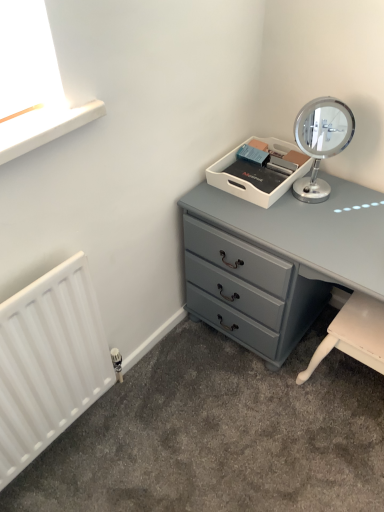
The width and height of the screenshot is (384, 512). What do you see at coordinates (283, 260) in the screenshot?
I see `matte gray chest of drawers at center` at bounding box center [283, 260].

This screenshot has height=512, width=384. I want to click on matte gray chest of drawers at center, so click(x=283, y=260).

From the image's perspective, is polished chrome mirror at upper right located beneath matte gray chest of drawers at center?

No, from the image's perspective, polished chrome mirror at upper right is not below matte gray chest of drawers at center.

Is polished chrome mirror at upper right not close to matte gray chest of drawers at center?

They are positioned close to each other.

Does polished chrome mirror at upper right lie behind matte gray chest of drawers at center?

Yes, polished chrome mirror at upper right is further from the camera.

From the image's perspective, is white matte radiator at lower left over white plastic tray at upper center?

No.

Is white plastic tray at upper center a part of white matte radiator at lower left?

That's incorrect, white plastic tray at upper center is not inside white matte radiator at lower left.

Considering the positions of objects white matte radiator at lower left and white plastic tray at upper center in the image provided, who is more to the left, white matte radiator at lower left or white plastic tray at upper center?

From the viewer's perspective, white matte radiator at lower left appears more on the left side.

Considering the relative sizes of white matte radiator at lower left and white plastic tray at upper center in the image provided, is white matte radiator at lower left thinner than white plastic tray at upper center?

Yes, white matte radiator at lower left is thinner than white plastic tray at upper center.

Can you confirm if white matte radiator at lower left is positioned to the left of matte gray chest of drawers at center?

Yes, white matte radiator at lower left is to the left of matte gray chest of drawers at center.

Would you say white matte radiator at lower left is a long distance from matte gray chest of drawers at center?

No.

Between white matte radiator at lower left and matte gray chest of drawers at center, which one is positioned behind?

matte gray chest of drawers at center.

Is white matte radiator at lower left taller than matte gray chest of drawers at center?

Correct, white matte radiator at lower left is much taller as matte gray chest of drawers at center.

Which of these two, polished chrome mirror at upper right or white matte radiator at lower left, stands shorter?

With less height is polished chrome mirror at upper right.

Is polished chrome mirror at upper right not within white matte radiator at lower left?

Yes, polished chrome mirror at upper right is not within white matte radiator at lower left.

Does point (308, 113) come behind point (5, 365)?

Yes, it is behind point (5, 365).

Is polished chrome mirror at upper right facing towards white matte radiator at lower left?

No, polished chrome mirror at upper right is not aimed at white matte radiator at lower left.

From a real-world perspective, is white plastic tray at upper center positioned over polished chrome mirror at upper right based on gravity?

No, from a real-world perspective, white plastic tray at upper center is not above polished chrome mirror at upper right.

Are white plastic tray at upper center and polished chrome mirror at upper right far apart?

No, white plastic tray at upper center is not far away from polished chrome mirror at upper right.

In the scene shown: Is white plastic tray at upper center behind polished chrome mirror at upper right?

Yes, it is.

Which is behind, point (313, 112) or point (271, 144)?

The point (271, 144) is farther from the camera.

Does polished chrome mirror at upper right appear on the left side of white plastic tray at upper center?

No, polished chrome mirror at upper right is not to the left of white plastic tray at upper center.

Is polished chrome mirror at upper right smaller than white plastic tray at upper center?

No.

Who is shorter, polished chrome mirror at upper right or white plastic tray at upper center?

With less height is white plastic tray at upper center.

From a real-world perspective, is matte gray chest of drawers at center beneath white plastic tray at upper center?

Yes, from a real-world perspective, matte gray chest of drawers at center is under white plastic tray at upper center.

Considering the relative positions of matte gray chest of drawers at center and white plastic tray at upper center in the image provided, is matte gray chest of drawers at center to the left of white plastic tray at upper center from the viewer's perspective?

No.

Is matte gray chest of drawers at center placed right next to white plastic tray at upper center?

They are not placed beside each other.

Considering the relative sizes of matte gray chest of drawers at center and white plastic tray at upper center in the image provided, is matte gray chest of drawers at center thinner than white plastic tray at upper center?

No, matte gray chest of drawers at center is not thinner than white plastic tray at upper center.

The image size is (384, 512). Identify the location of the chest of drawers directly beneath the polished chrome mirror at upper right (from a real-world perspective). (283, 260).

Identify the location of radiator below the white plastic tray at upper center (from the image's perspective). The width and height of the screenshot is (384, 512). (49, 362).

Considering their positions, is white matte radiator at lower left positioned further to white plastic tray at upper center than polished chrome mirror at upper right?

white matte radiator at lower left lies further to white plastic tray at upper center than the other object.

Considering their positions, is matte gray chest of drawers at center positioned further to white matte radiator at lower left than white plastic tray at upper center?

white plastic tray at upper center lies further to white matte radiator at lower left than the other object.

Looking at this image, which object lies nearer to the anchor point white plastic tray at upper center, polished chrome mirror at upper right or white matte radiator at lower left?

polished chrome mirror at upper right is closer to white plastic tray at upper center.

Estimate the real-world distances between objects in this image. Which object is closer to white plastic tray at upper center, matte gray chest of drawers at center or white matte radiator at lower left?

matte gray chest of drawers at center.

Considering their positions, is polished chrome mirror at upper right positioned further to white plastic tray at upper center than matte gray chest of drawers at center?

matte gray chest of drawers at center.

Which object lies further to the anchor point matte gray chest of drawers at center, polished chrome mirror at upper right or white matte radiator at lower left?

The object further to matte gray chest of drawers at center is white matte radiator at lower left.

From the image, which object appears to be farther from matte gray chest of drawers at center, white matte radiator at lower left or polished chrome mirror at upper right?

Among the two, white matte radiator at lower left is located further to matte gray chest of drawers at center.

Considering their positions, is matte gray chest of drawers at center positioned further to white matte radiator at lower left than polished chrome mirror at upper right?

The object further to white matte radiator at lower left is polished chrome mirror at upper right.

You are a GUI agent. You are given a task and a screenshot of the screen. Output one action in this format:
    pyautogui.click(x=<x>, y=<y>)
    Task: Click on the printer between polished chrome mirror at upper right and matte gray chest of drawers at center in the vertical direction
    
    Given the screenshot: What is the action you would take?
    pyautogui.click(x=259, y=170)

The height and width of the screenshot is (512, 384). In order to click on printer located between white matte radiator at lower left and polished chrome mirror at upper right in the left-right direction in this screenshot , I will do point(259,170).

Where is `printer situated between white matte radiator at lower left and matte gray chest of drawers at center from left to right`? The image size is (384, 512). printer situated between white matte radiator at lower left and matte gray chest of drawers at center from left to right is located at coordinates (259, 170).

Identify the location of table lamp located between white matte radiator at lower left and matte gray chest of drawers at center in the left-right direction. This screenshot has width=384, height=512. (321, 142).